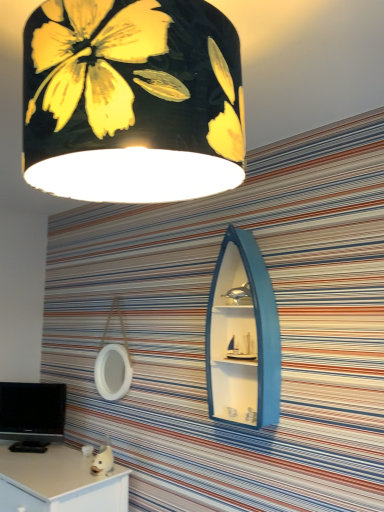
Question: From a real-world perspective, is black glossy computer monitor at lower left physically located above or below black matte lampshade at upper center?

Choices:
 (A) below
 (B) above

Answer: (A)

Question: In the image, is black glossy computer monitor at lower left positioned in front of or behind black matte lampshade at upper center?

Choices:
 (A) behind
 (B) front

Answer: (A)

Question: Estimate the real-world distances between objects in this image. Which object is farther from the black glossy computer monitor at lower left?

Choices:
 (A) black matte lampshade at upper center
 (B) white matte desk at lower left
 (C) blue matte boat-shaped cabinet at center

Answer: (A)

Question: Which is nearer to the blue matte boat-shaped cabinet at center?

Choices:
 (A) black glossy computer monitor at lower left
 (B) white matte desk at lower left
 (C) black matte lampshade at upper center

Answer: (C)